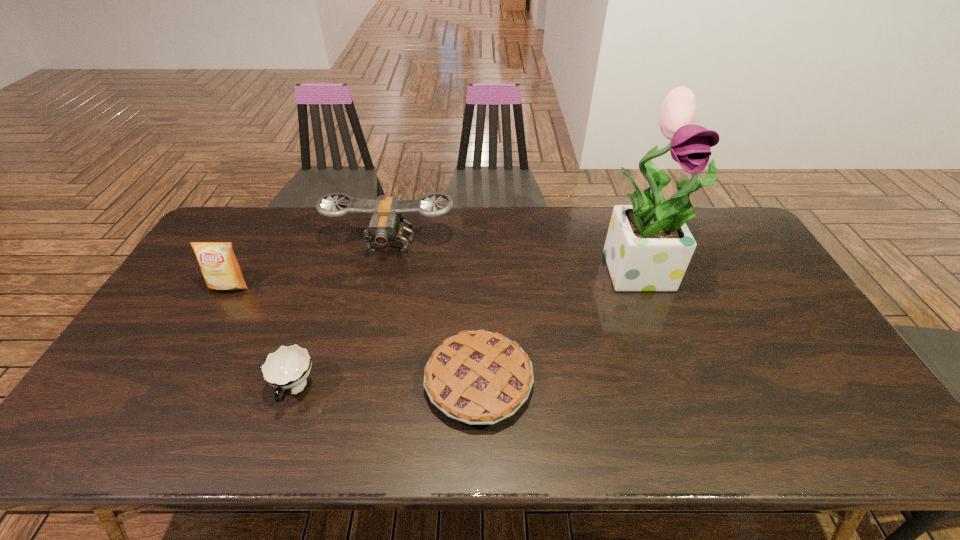
In the image, there is a desktop. Identify the location of vacant space at the near left corner. click(x=116, y=439).

The width and height of the screenshot is (960, 540). I want to click on vacant space at the far right corner of the desktop, so click(x=695, y=224).

Image resolution: width=960 pixels, height=540 pixels. In order to click on empty location between the crisp (potato chip) and the tallest object in this screenshot , I will do `click(437, 278)`.

This screenshot has width=960, height=540. What are the coordinates of `free space between the fourth tallest object and the tallest object` in the screenshot? It's located at (469, 329).

What are the coordinates of `vacant region between the shortest object and the rightmost object` in the screenshot? It's located at (562, 326).

I want to click on vacant area that lies between the tallest object and the crisp (potato chip), so click(x=437, y=278).

You are a GUI agent. You are given a task and a screenshot of the screen. Output one action in this format:
    pyautogui.click(x=<x>, y=<y>)
    Task: Click on the vacant space in between the drone and the shortest object
    Image resolution: width=960 pixels, height=540 pixels.
    Given the screenshot: What is the action you would take?
    pyautogui.click(x=435, y=313)

The height and width of the screenshot is (540, 960). In order to click on empty space between the fourth tallest object and the leftmost object in this screenshot , I will do `click(262, 338)`.

The width and height of the screenshot is (960, 540). I want to click on vacant point located between the drone and the shortest object, so click(435, 313).

Locate an element on the screen. vacant area that lies between the crisp (potato chip) and the rightmost object is located at coordinates 437,278.